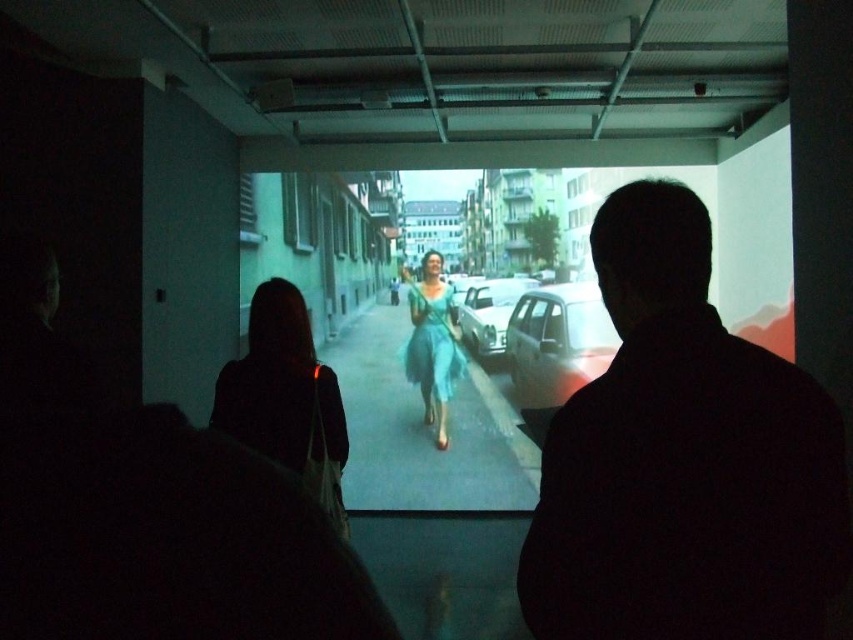
Question: Is teal tulle dress at center smaller than teal satin dress at center?

Choices:
 (A) yes
 (B) no

Answer: (B)

Question: Does teal tulle dress at center appear on the right side of shiny silver car at center?

Choices:
 (A) yes
 (B) no

Answer: (B)

Question: Based on their relative distances, which object is nearer to the black matte man at right?

Choices:
 (A) shiny silver car at center
 (B) metallic silver car at center
 (C) teal satin dress at center
 (D) teal tulle dress at center

Answer: (D)

Question: Among these points, which one is nearest to the camera?

Choices:
 (A) (271, 404)
 (B) (444, 310)
 (C) (556, 570)

Answer: (C)

Question: Can you confirm if black matte man at right is wider than metallic silver car at center?

Choices:
 (A) yes
 (B) no

Answer: (B)

Question: Which object is closer to the camera taking this photo?

Choices:
 (A) metallic silver car at center
 (B) black matte man at right

Answer: (B)